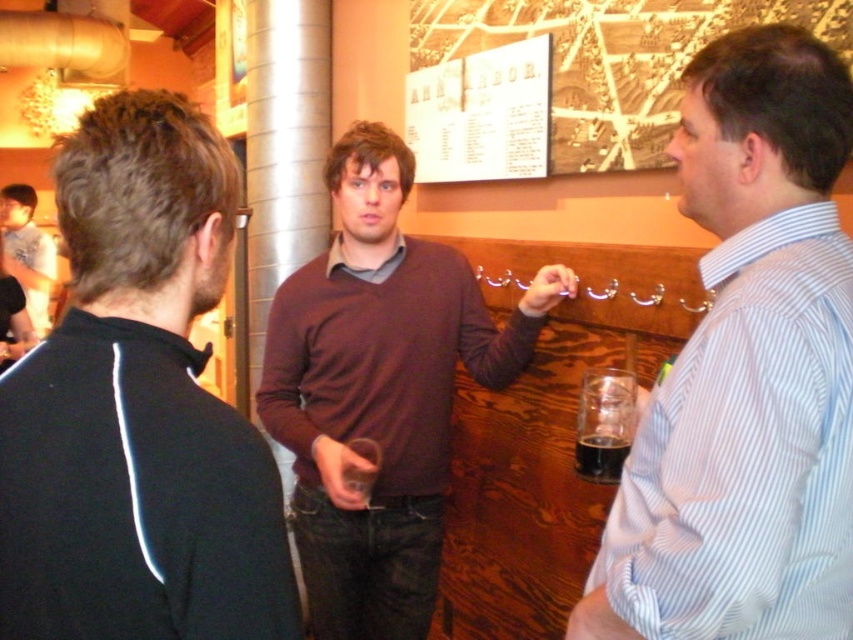
Based on the photo, you are at the bar and want to place your phone on the black matte jacket at left. Is the jacket within reach from your current position at the bar counter?

The black matte jacket at left is located at point (138, 408), which is likely within reach from the bar counter. You can place your phone there.

You are a bartender who needs to reach the transparent glass at center without knocking over the white striped shirt at right. Given their heights, which object should you move first to avoid causing a spill?

The white striped shirt at right is much taller than the transparent glass at center, so you should move the transparent glass at center first to avoid knocking over the taller object.

You are standing in the bar and want to reach the point marked at coordinates point (169, 573). If your arm length is 25 inches, can you reach that point without moving your feet?

The distance between you and the point (169, 573) is 25.45 inches. Since your arm is only 25 inches long, you cannot reach it without moving your feet.